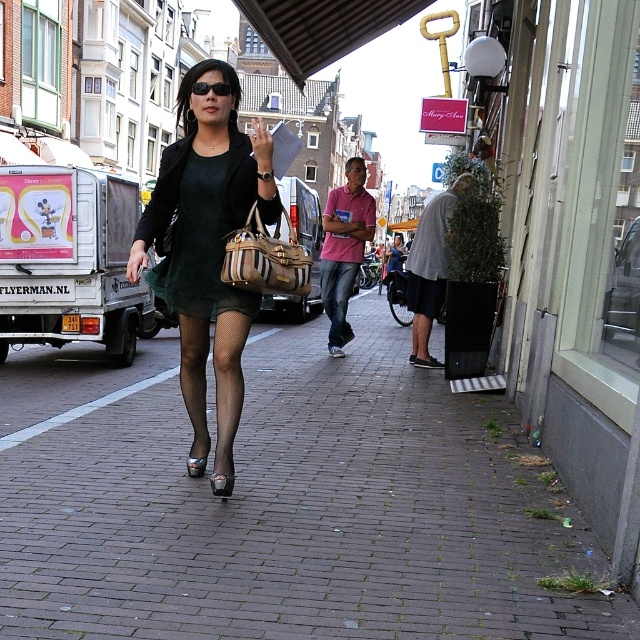
You are a fashion designer observing a model wearing the green matte dress at center and gray fabric short at right. Which clothing item is covering the other?

The green matte dress at center is positioned over the gray fabric short at right, so the dress is covering the shorts.

You are a photographer standing in the middle of the street. You want to take a photo that includes both the brick pavement at center and the pink cotton shirt at center. Which object should you focus on first to ensure both are in sharp focus?

You should focus on the brick pavement at center first since it is closer to the viewer than the pink cotton shirt at center, ensuring depth of field captures both.

Where is the brick pavement at center located in the image?

The brick pavement at center is located at point (282, 502) in the image.